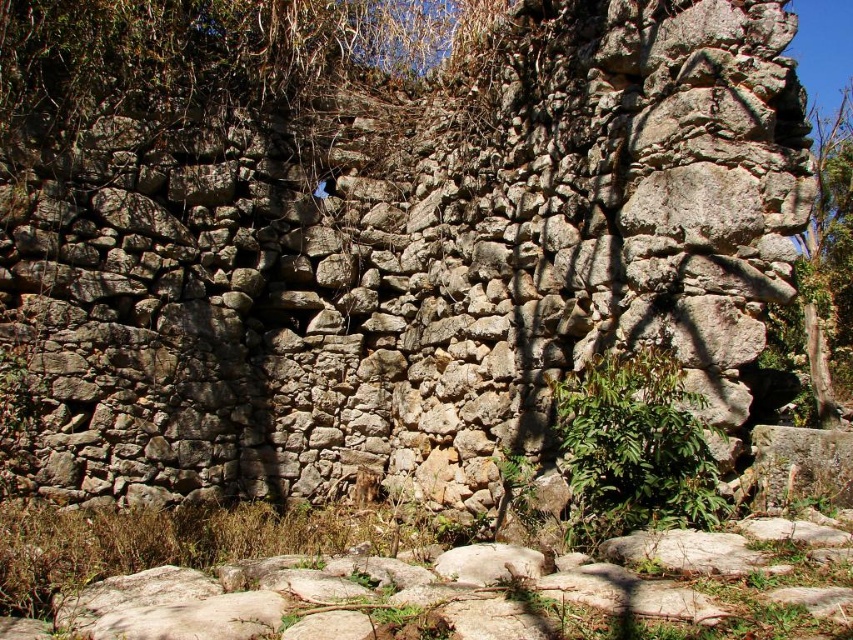
You are standing in front of the ancient stone wall and want to place a 30 meter long ladder against the wall. The ladder must be placed between the brown rough stone wall at upper center and the green leafy plant at center. Will the ladder fit horizontally between them?

The distance between the brown rough stone wall at upper center and the green leafy plant at center is 30.88 meters, so the 30 meter long ladder will fit horizontally between them since it is shorter than the available space.

You are standing in front of an ancient stone wall with two points marked on it. You want to touch both points with your finger. Which point should you reach for first, point [30,26] or point [646,358]?

You should reach for point [30,26] first because it is closer to you than point [646,358], which is further away.

You are standing in front of an ancient structure and want to take a photo of the brown rough stone wall at upper center. If your camera can focus on objects up to 30 meters away, will it be able to capture the wall clearly?

The brown rough stone wall at upper center is 30.03 meters away from the camera, which is slightly beyond the camera focus limit of 30 meters. Therefore, the camera may not be able to capture the wall clearly.